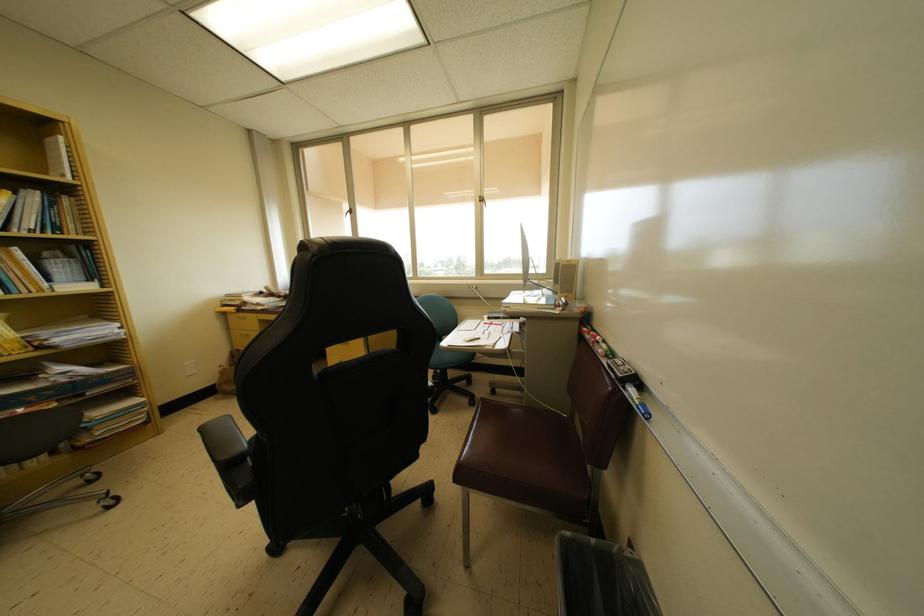
Locate an element on the screen. black chair armrest is located at coordinates (224, 446).